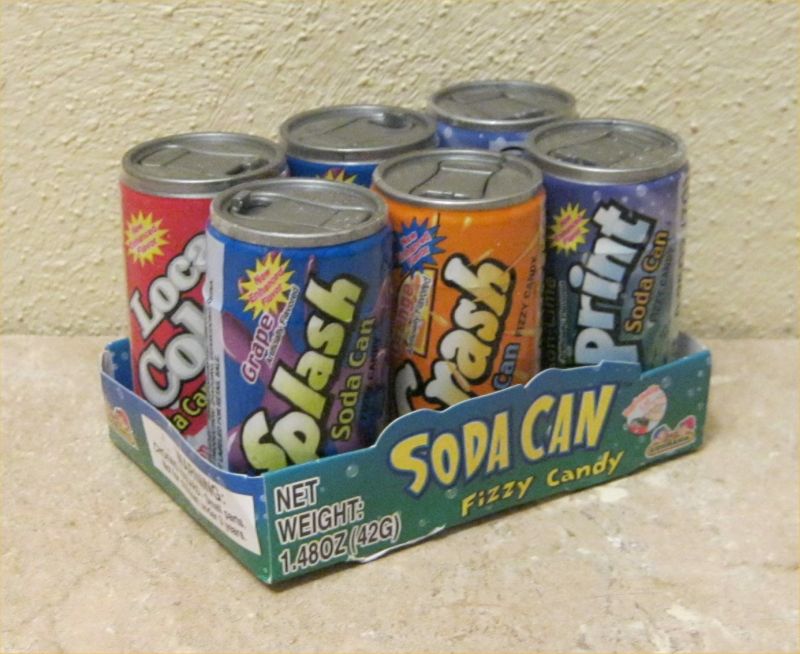
I want to click on wall, so click(137, 61).